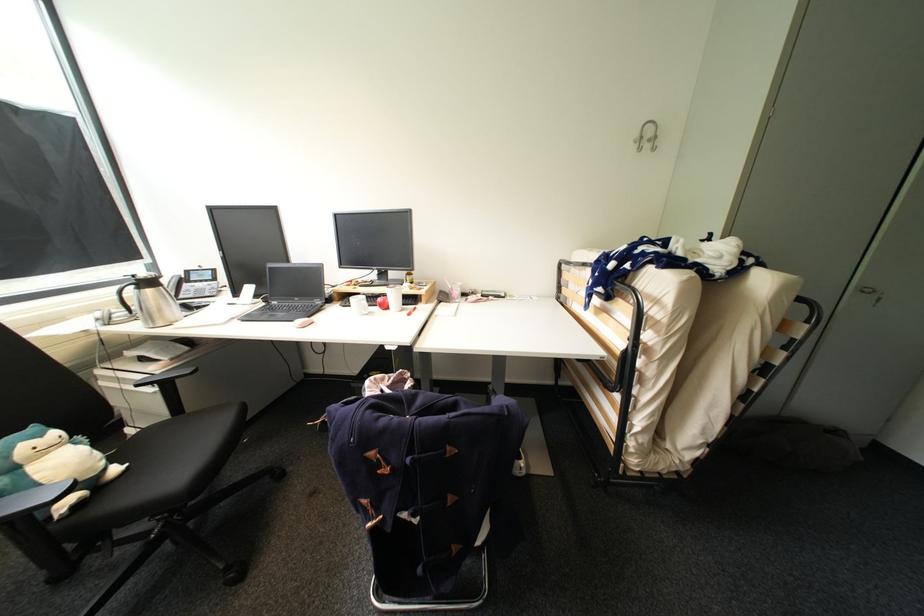
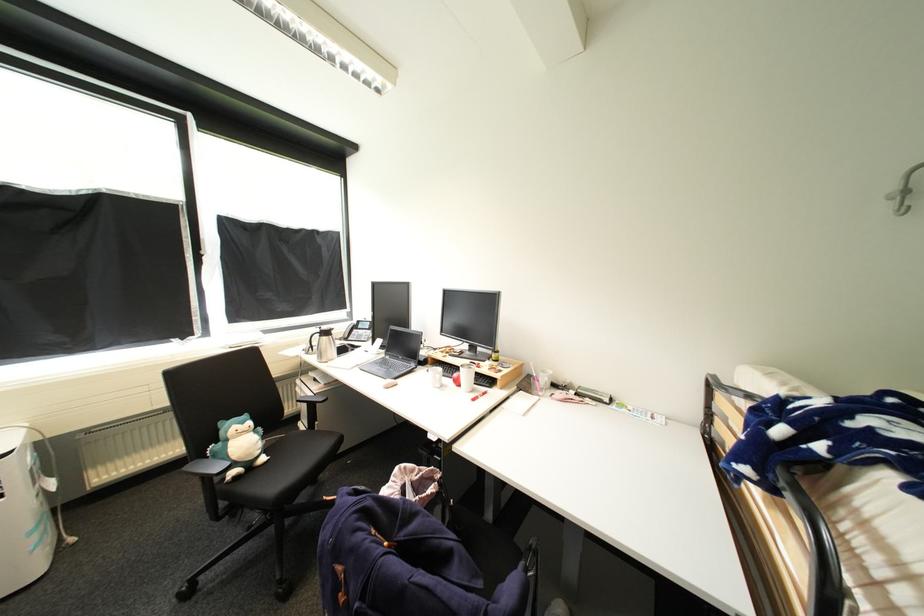
Question: The first image is from the beginning of the video and the second image is from the end. How did the camera likely rotate when shooting the video?

Choices:
 (A) Left
 (B) Right
 (C) Up
 (D) Down

Answer: (A)